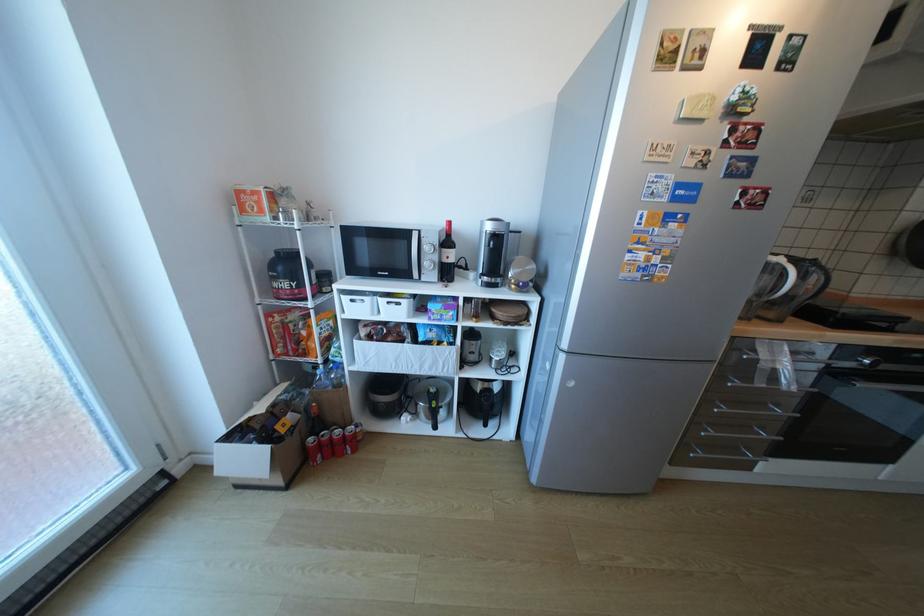
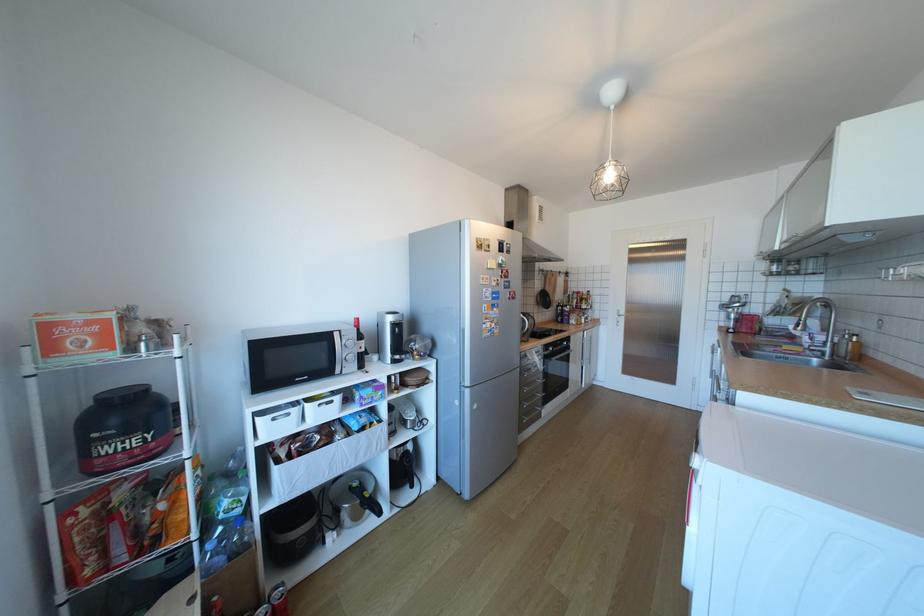
Find the pixel in the second image that matches [361,301] in the first image.

(283, 419)